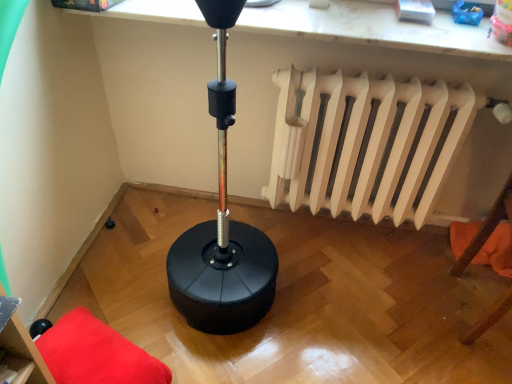
Image resolution: width=512 pixels, height=384 pixels. Identify the location of free space above velvet red cushion at lower left, placed as the 1th furniture when sorted from back to front (from a real-world perspective). (93, 352).